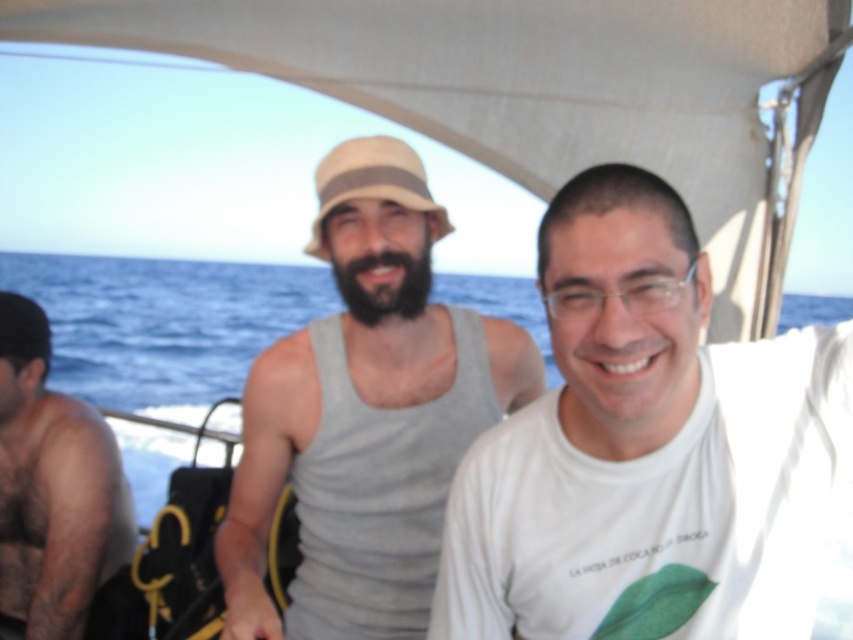
Does white matte t-shirt at center have a lesser height compared to skinny black tank top at left?

Correct, white matte t-shirt at center is not as tall as skinny black tank top at left.

Is white matte t-shirt at center further to the viewer compared to skinny black tank top at left?

No, it is in front of skinny black tank top at left.

Does point (727, 632) lie in front of point (19, 394)?

That is True.

Locate an element on the screen. The image size is (853, 640). white matte t-shirt at center is located at coordinates (646, 449).

Can you confirm if white matte t-shirt at center is wider than gray matte tank top at center?

No, white matte t-shirt at center is not wider than gray matte tank top at center.

Is white matte t-shirt at center thinner than gray matte tank top at center?

Yes.

At what (x,y) coordinates should I click in order to perform the action: click on white matte t-shirt at center. Please return your answer as a coordinate pair (x, y). Looking at the image, I should click on (646, 449).

Measure the distance between point (x=795, y=312) and camera.

Point (x=795, y=312) and camera are 31.19 feet apart.

Which is more to the left, blue water at center or skinny black tank top at left?

Positioned to the left is skinny black tank top at left.

Is point (514, 296) positioned before point (99, 419)?

No, it is behind (99, 419).

At what (x,y) coordinates should I click in order to perform the action: click on blue water at center. Please return your answer as a coordinate pair (x, y). The height and width of the screenshot is (640, 853). Looking at the image, I should click on (161, 323).